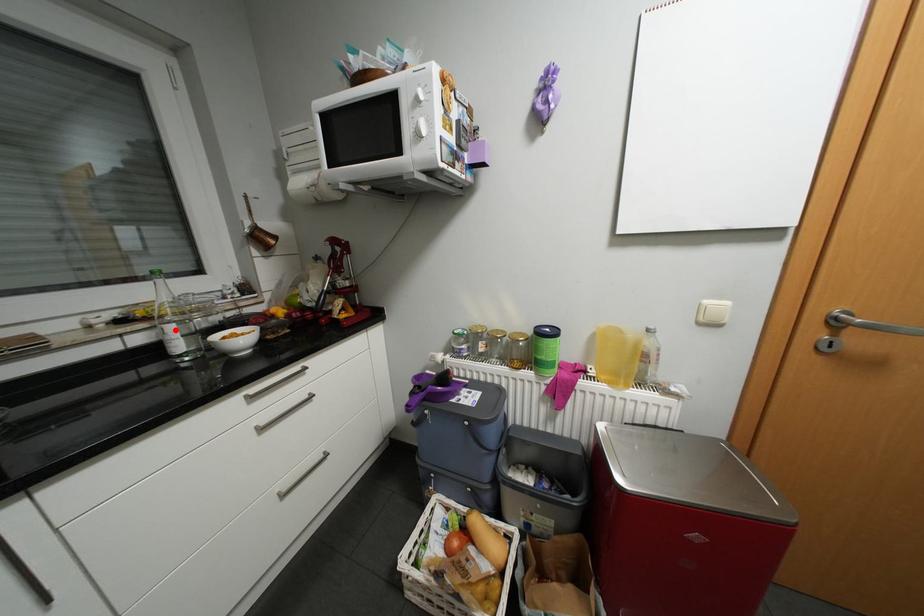
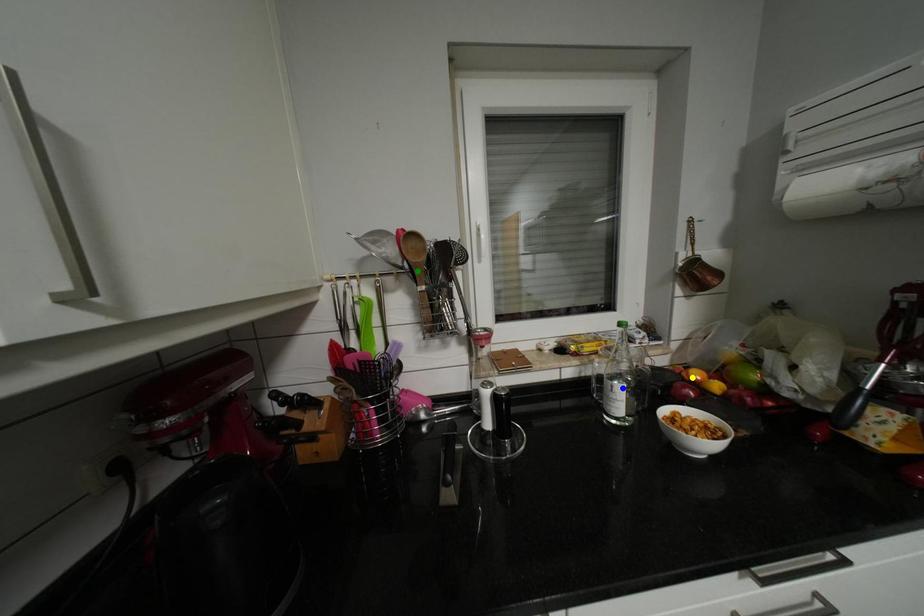
Question: I am providing you with two images of the same scene from different viewpoints. A red point is marked on the first image. You are given multiple points on the second image. Which point in image 2 is actually the same real-world point as the red point in image 1?

Choices:
 (A) blue point
 (B) yellow point
 (C) green point

Answer: (A)